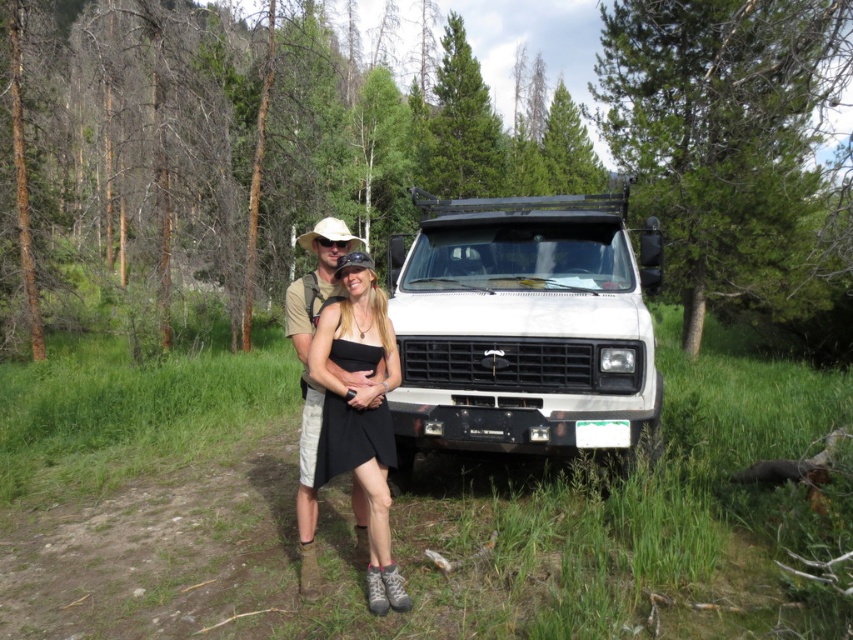
You are planning to take a photo of the white matte suv at center and the black satin dress at center from a distance of 10 feet. Will both subjects be fully visible in the frame?

The white matte suv at center and black satin dress at center are 6.60 feet apart. Since the distance between them is less than 10 feet, both subjects will be fully visible in the frame when photographed from 10 feet away.

You are a photographer trying to capture a photo of the black satin dress at center without the white matte suv at center blocking the view. Is the dress visible from your current position?

The white matte suv at center is above the black satin dress at center, so the dress is partially or fully obscured by the SUV and may not be fully visible in the photo.